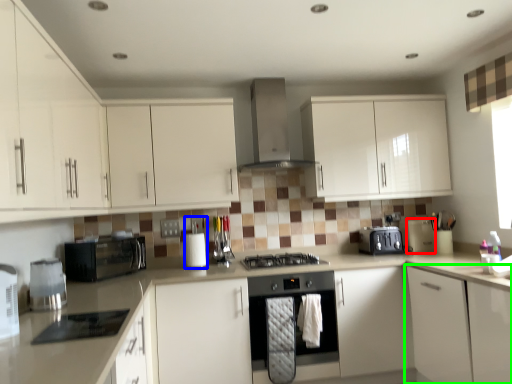
Question: Which object is the closest to the appliance (highlighted by a red box)? Choose among these: appliance (highlighted by a blue box) or cabinetry (highlighted by a green box).

Choices:
 (A) appliance
 (B) cabinetry

Answer: (B)